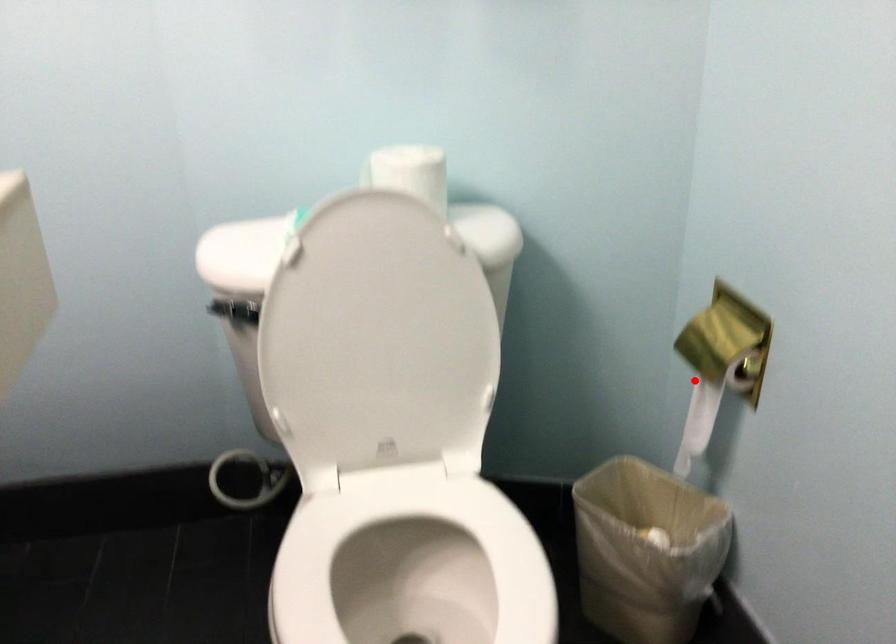
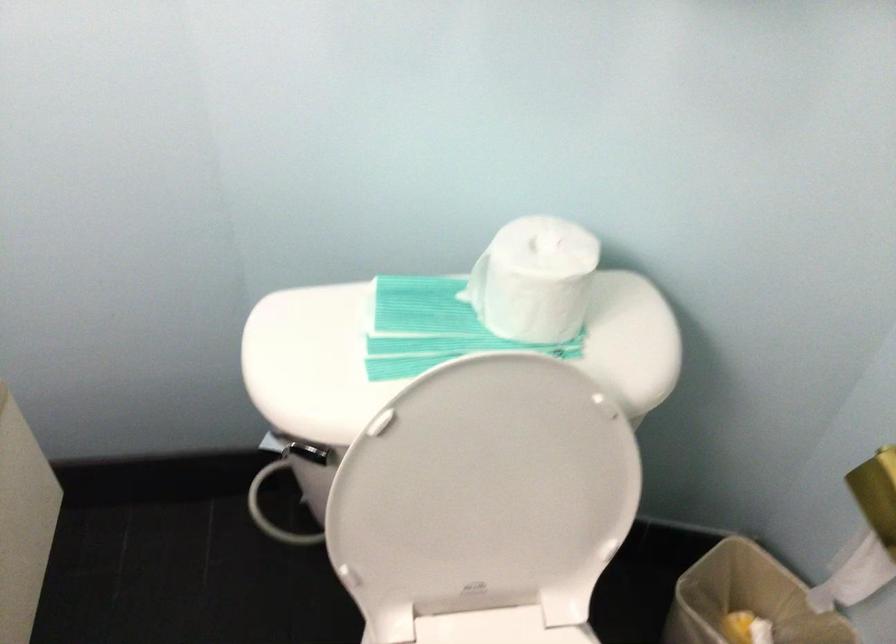
In the second image, find the point that corresponds to the highlighted location in the first image.

(866, 534)